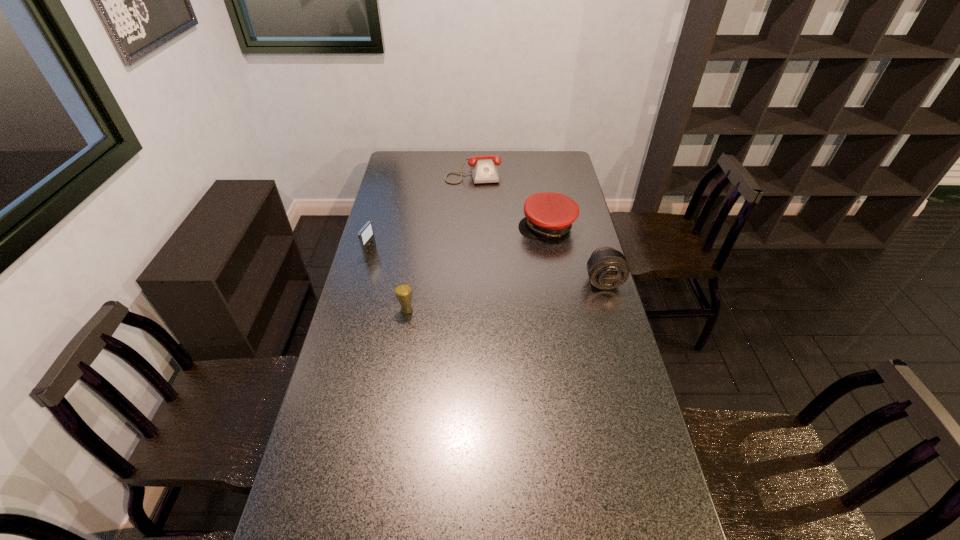
At what (x,y) coordinates should I click in order to perform the action: click on the tallest object. Please return your answer as a coordinate pair (x, y). Image resolution: width=960 pixels, height=540 pixels. Looking at the image, I should click on (403, 291).

Identify the location of straw for drinking. (403, 291).

Identify the location of telephoto lens. This screenshot has width=960, height=540. (607, 268).

This screenshot has width=960, height=540. Identify the location of the leftmost object. (366, 235).

This screenshot has height=540, width=960. I want to click on the third nearest object, so click(x=366, y=235).

I want to click on the second farthest object, so click(547, 214).

Where is `cap`? This screenshot has width=960, height=540. cap is located at coordinates (547, 214).

Identify the location of the farthest object. pyautogui.click(x=484, y=169).

Identify the location of the shortest object. (484, 169).

The image size is (960, 540). What are the coordinates of `vacant point located 0.290m on the front of the tallest object` in the screenshot? It's located at (395, 391).